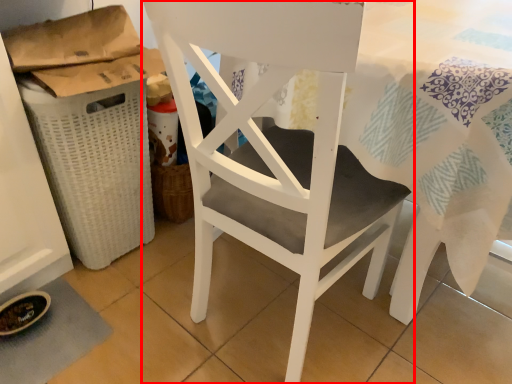
Question: From the image, what is the correct spatial relationship of chair (annotated by the red box) in relation to laundry basket?

Choices:
 (A) right
 (B) left

Answer: (A)